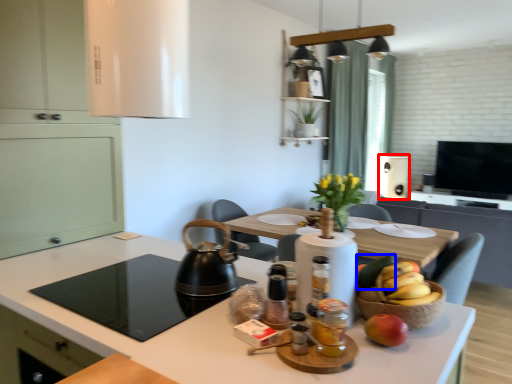
Question: Among these objects, which one is nearest to the camera, appliance (highlighted by a red box) or fruit (highlighted by a blue box)?

Choices:
 (A) appliance
 (B) fruit

Answer: (B)